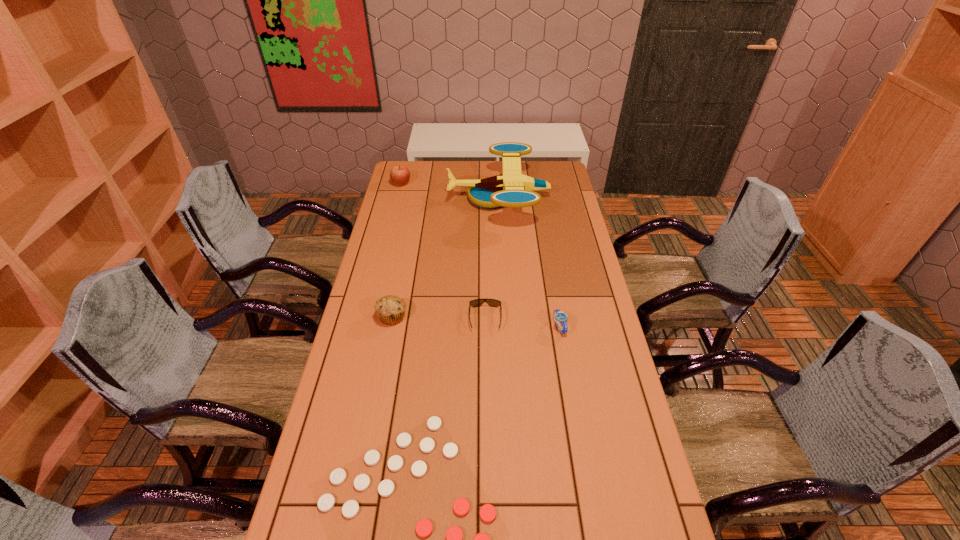
Where is `drone`? Image resolution: width=960 pixels, height=540 pixels. drone is located at coordinates (512, 189).

Where is `apple`? This screenshot has height=540, width=960. apple is located at coordinates (400, 175).

At what (x,y) coordinates should I click in order to perform the action: click on muffin. Please return your answer as a coordinate pair (x, y). The image size is (960, 540). Looking at the image, I should click on (390, 309).

Find the location of a particular element. The width and height of the screenshot is (960, 540). watch is located at coordinates [559, 317].

Where is `sunglasses`? The width and height of the screenshot is (960, 540). sunglasses is located at coordinates (477, 302).

Locate an element on the screen. This screenshot has width=960, height=540. blank area located 0.170m at the cockpit of the tallest object is located at coordinates (411, 198).

Locate an element on the screen. vacant position located 0.060m at the cockpit of the tallest object is located at coordinates (435, 198).

At what (x,y) coordinates should I click in order to perform the action: click on vacant region located at the cockpit of the tallest object. Please return your answer as a coordinate pair (x, y). This screenshot has height=540, width=960. Looking at the image, I should click on (409, 198).

Identify the location of free region located 0.300m on the front of the apple. (391, 226).

Locate an element on the screen. The width and height of the screenshot is (960, 540). free region located on the front of the third tallest object is located at coordinates (378, 387).